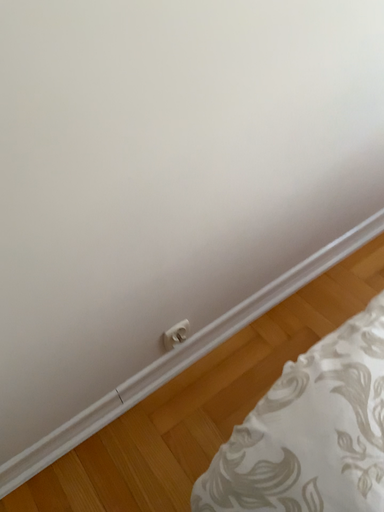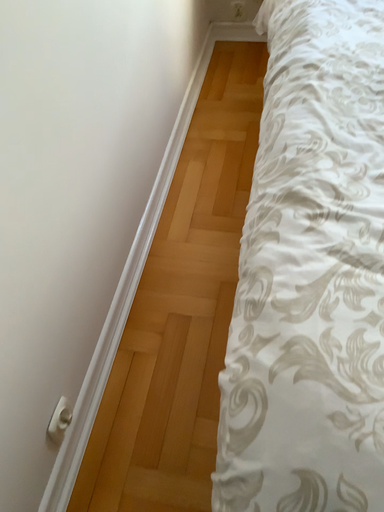
Question: How did the camera likely rotate when shooting the video?

Choices:
 (A) rotated right
 (B) rotated left

Answer: (A)